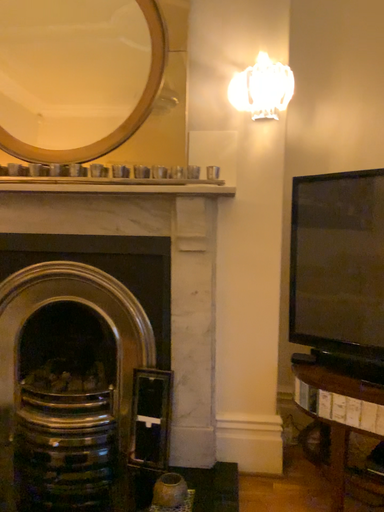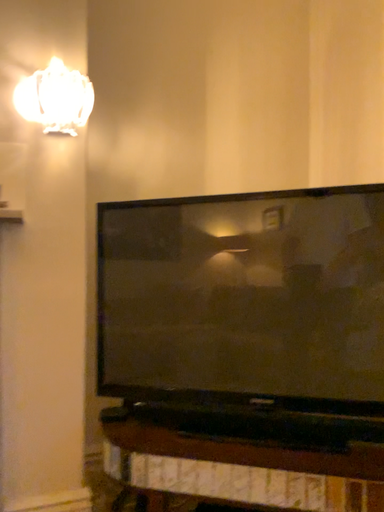
Question: How did the camera likely rotate when shooting the video?

Choices:
 (A) rotated left
 (B) rotated right

Answer: (B)